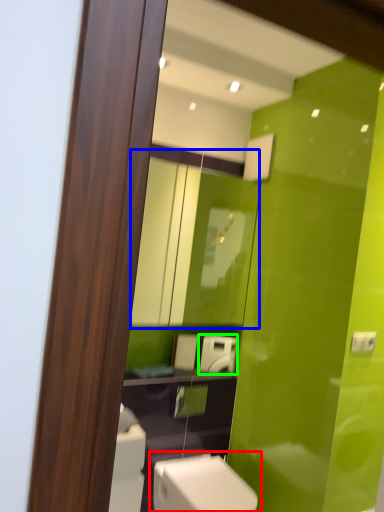
Question: Based on their relative distances, which object is farther from toilet (highlighted by a red box)? Choose from mirror (highlighted by a blue box) and appliance (highlighted by a green box).

Choices:
 (A) mirror
 (B) appliance

Answer: (A)